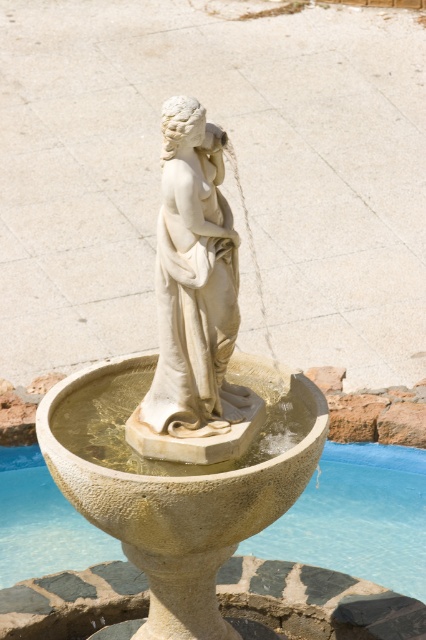
You are standing in front of the fountain described in the scene. There is a point labeled at coordinates (x=184, y=408). What does this point represent?

The point at coordinates (x=184, y=408) represents the white stone statue at center.

You are standing in front of the classical fountain and want to know how far the point at coordinates (247, 500) is from your current position. Can you determine the distance?

The point at coordinates (247, 500) is 24.75 feet away from the camera, so the distance from your current position to that point is 24.75 feet.

You are an artist planning to create a scale model of the fountain. You have two statues available for the central figure. One is the white stone statue at center, and the other is the white marble statue at center. If you want to ensure the model is as accurate as possible, which statue should you choose for the central figure based on their sizes?

The white stone statue at center is bigger than the white marble statue at center. To create an accurate scale model, you should choose the white marble statue at center to ensure proper proportions.